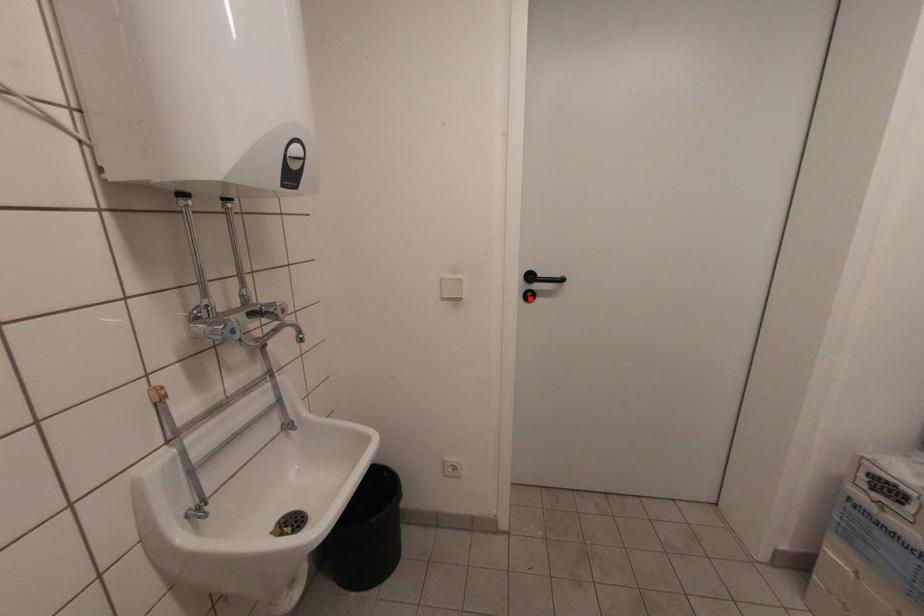
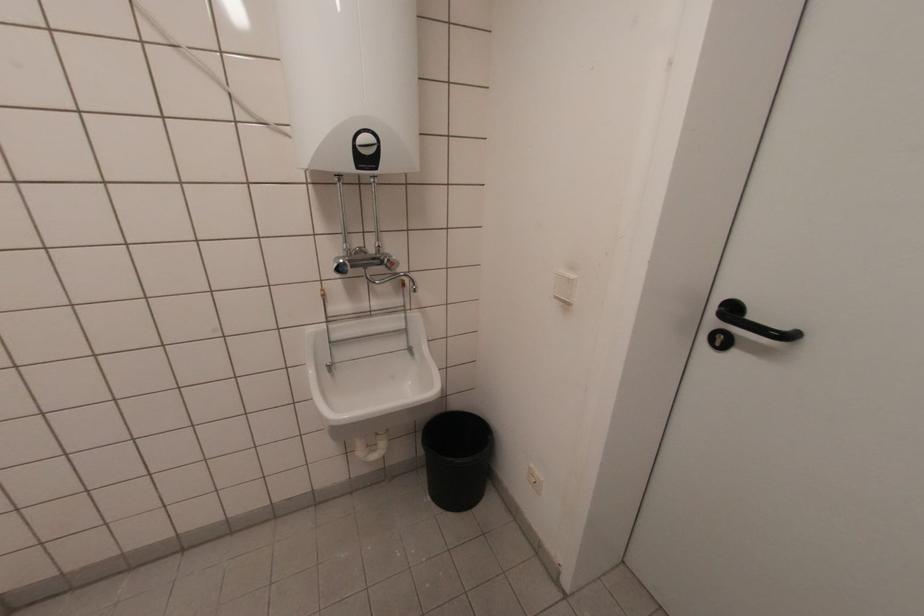
In the second image, find the point that corresponds to the highlighted location in the first image.

(719, 344)